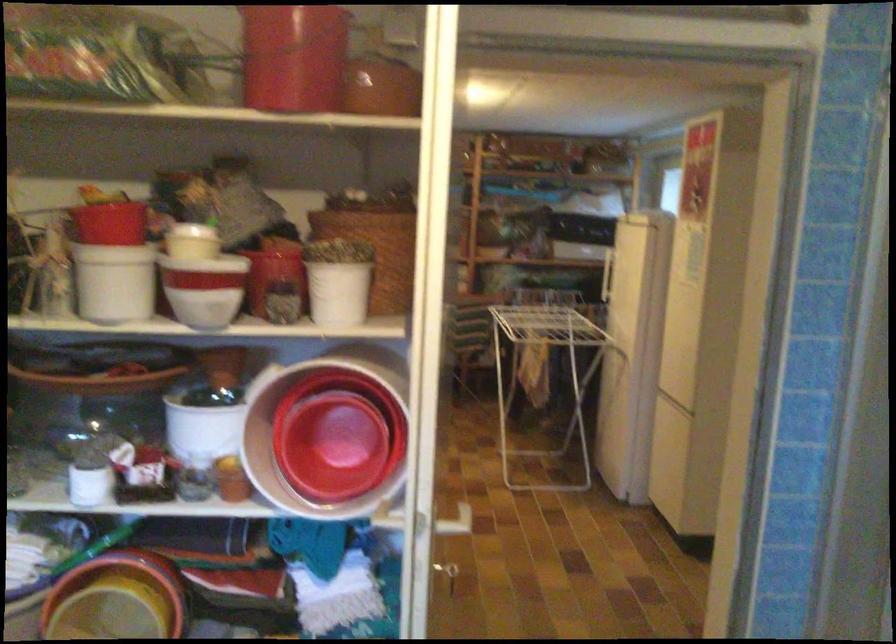
Find where to lift the small white pot. Please return your answer as a coordinate pair (x, y).

(114, 281)